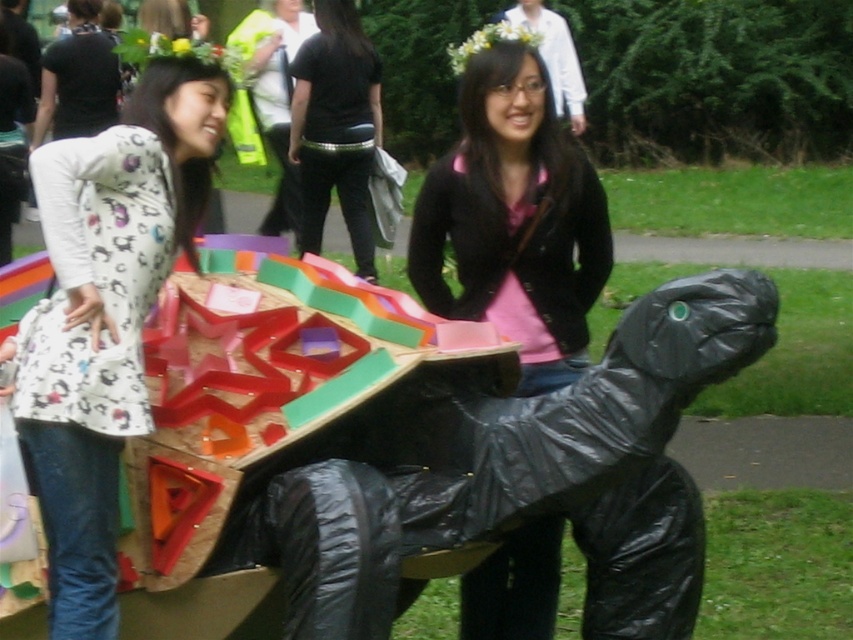
Question: Is matte black turtle at center bigger than black leather pants at center?

Choices:
 (A) no
 (B) yes

Answer: (A)

Question: Which of the following is the closest to the observer?

Choices:
 (A) white leopard print dress at left
 (B) black leather pants at center
 (C) matte black turtle at center

Answer: (A)

Question: Can you confirm if white leopard print dress at left is wider than matte black turtle at center?

Choices:
 (A) yes
 (B) no

Answer: (B)

Question: Which point is farther to the camera?

Choices:
 (A) white leopard print dress at left
 (B) matte black turtle at center

Answer: (B)

Question: Is white leopard print dress at left to the right of black leather pants at center from the viewer's perspective?

Choices:
 (A) yes
 (B) no

Answer: (B)

Question: Estimate the real-world distances between objects in this image. Which object is farther from the black leather pants at center?

Choices:
 (A) white leopard print dress at left
 (B) matte black turtle at center

Answer: (A)